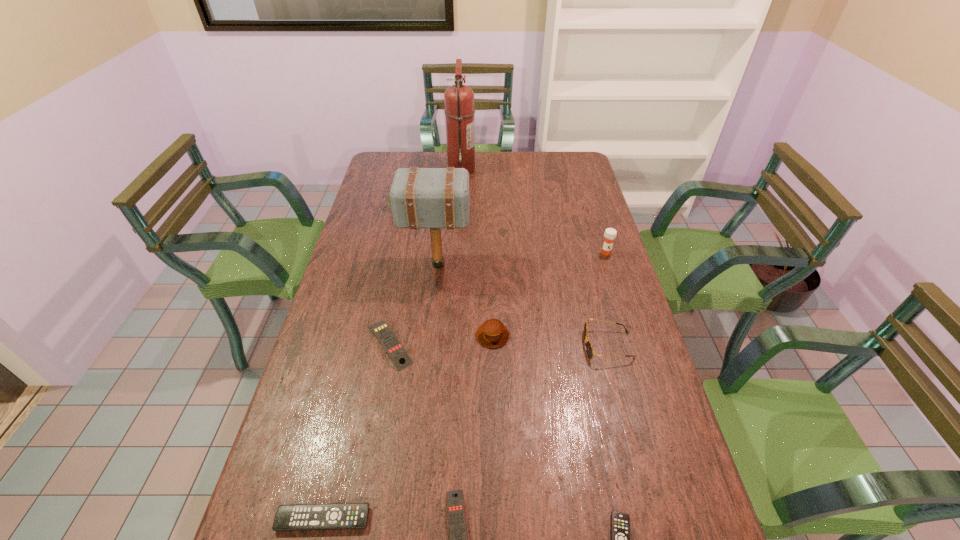
I want to click on black sunglasses, so click(x=589, y=348).

This screenshot has height=540, width=960. In order to click on the farther yellow remote control in this screenshot , I will do `click(397, 353)`.

Find the location of a particular element. the fourth shortest object is located at coordinates (397, 353).

I want to click on the left black remote control, so click(x=335, y=516).

The height and width of the screenshot is (540, 960). I want to click on vacant space located on the front-facing side of the fire extinguisher, so click(548, 169).

Locate an element on the screen. The height and width of the screenshot is (540, 960). vacant position located on the striking surface of the gray mallet is located at coordinates (571, 265).

Find the location of a particular element. free spot located 0.190m on the front of the avocado is located at coordinates (390, 245).

At what (x,y) coordinates should I click in order to perform the action: click on free region located 0.260m on the label side of the medicine. Please return your answer as a coordinate pair (x, y). Looking at the image, I should click on (625, 314).

At what (x,y) coordinates should I click in order to perform the action: click on vacant space located 0.190m on the front of the fifth tallest object. Please return your answer as a coordinate pair (x, y). The image size is (960, 540). Looking at the image, I should click on (494, 410).

At what (x,y) coordinates should I click in order to perform the action: click on vacant space located on the lenses of the black sunglasses. Please return your answer as a coordinate pair (x, y). Looking at the image, I should click on (563, 346).